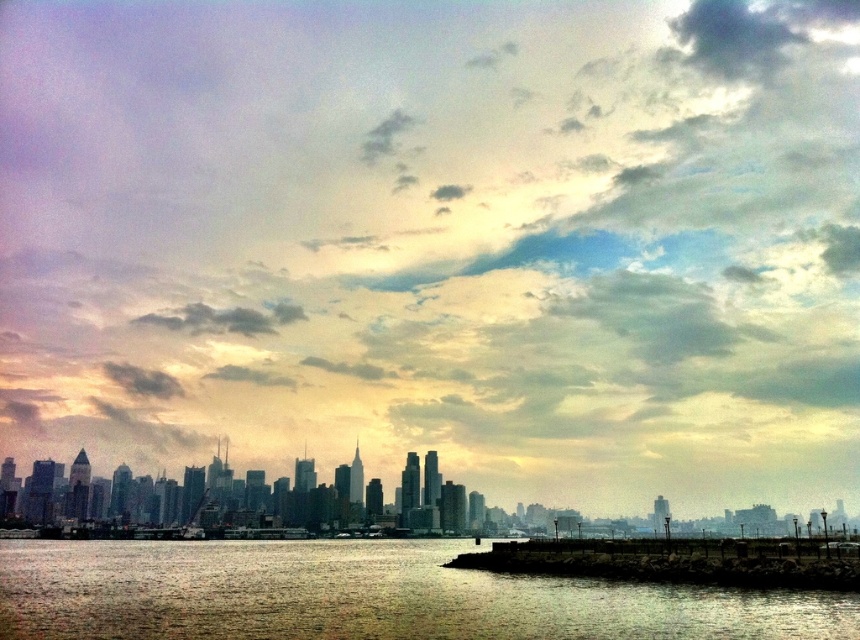
Which is more to the right, cloudy sky at upper center or dark gray cloud at upper center?

Positioned to the right is cloudy sky at upper center.

Is point (845, 163) closer to camera compared to point (280, 324)?

That is False.

Find the location of `cloudy sky at upper center`. cloudy sky at upper center is located at coordinates (435, 232).

Can you confirm if reflective silver water at lower center is positioned below rocky concrete wall at lower right?

Yes.

Can you confirm if reflective silver water at lower center is positioned to the left of rocky concrete wall at lower right?

Correct, you'll find reflective silver water at lower center to the left of rocky concrete wall at lower right.

Is point (516, 625) less distant than point (618, 566)?

Yes, it is.

Where is `reflective silver water at lower center`? Image resolution: width=860 pixels, height=640 pixels. reflective silver water at lower center is located at coordinates (367, 595).

Between rocky concrete wall at lower right and dark gray cloud at upper center, which one has more height?

With more height is rocky concrete wall at lower right.

Is rocky concrete wall at lower right further to camera compared to dark gray cloud at upper center?

No, rocky concrete wall at lower right is in front of dark gray cloud at upper center.

Which is behind, point (736, 541) or point (267, 317)?

Positioned behind is point (267, 317).

Where is `rocky concrete wall at lower right`? This screenshot has width=860, height=640. rocky concrete wall at lower right is located at coordinates (677, 561).